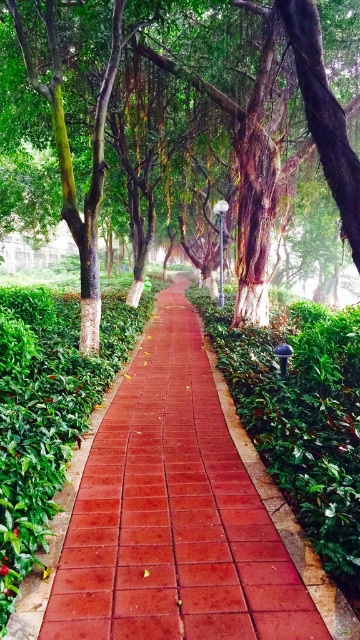
Is red brick path at center bigger than green matte tree at center?

Actually, red brick path at center might be smaller than green matte tree at center.

Which of these two, red brick path at center or green matte tree at center, stands shorter?

With less height is red brick path at center.

What do you see at coordinates (173, 515) in the screenshot?
I see `red brick path at center` at bounding box center [173, 515].

This screenshot has height=640, width=360. Find the location of `red brick path at center`. red brick path at center is located at coordinates (173, 515).